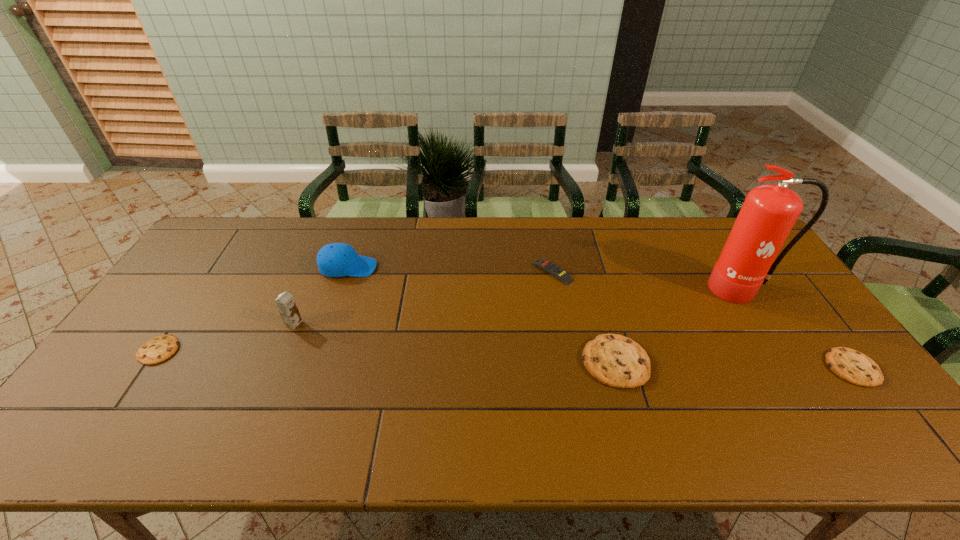
If equal spacing is the goal by inserting an additional cookie among them, please point out a vacant space for this new cookie. Please provide its 2D coordinates. Your answer should be formatted as a tuple, i.e. [(x, y)], where the tuple contains the x and y coordinates of a point satisfying the conditions above.

[(384, 356)]